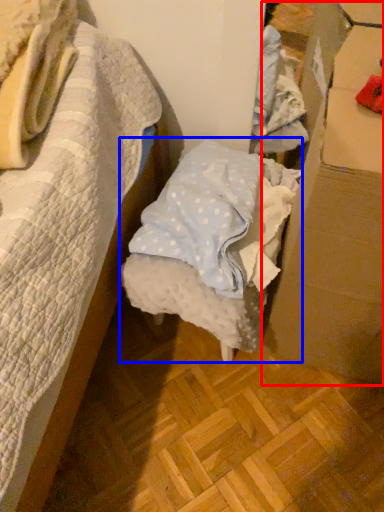
Question: Which point is closer to the camera, cardboard box (highlighted by a red box) or furniture (highlighted by a blue box)?

Choices:
 (A) cardboard box
 (B) furniture

Answer: (A)